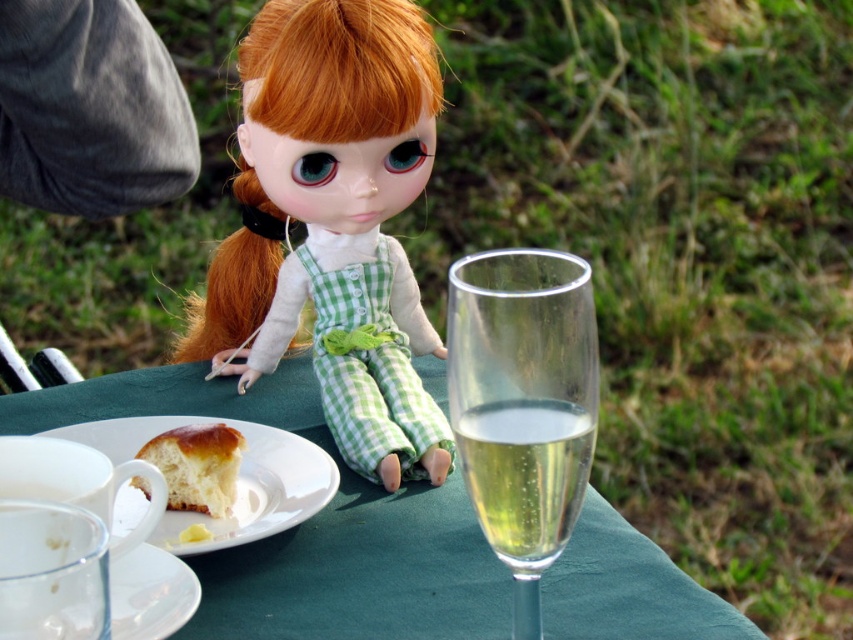
The doll is sitting at the table and wants to place a napkin between the white ceramic plate at lower left and the transparent glass saucer at lower left. Which object should the napkin be placed closer to if it needs to cover more surface area?

The napkin should be placed closer to the white ceramic plate at lower left because it is larger in size than the transparent glass saucer at lower left, allowing the napkin to cover more surface area.

You are standing at the position of the viewer and want to reach the point marked at coordinates point (271, 182). If your arm is 24 inches long, can you comfortably reach it without moving your feet?

The distance between you and the point (271, 182) is 23.37 inches, which is slightly shorter than your 24 inch arm length. Therefore, you can comfortably reach it without moving your feet.

You are a guest at a garden party and see the green checkered doll at center and the golden brown bread at center on the table. Which object is closer to the right edge of the table?

The green checkered doll at center is closer to the right edge of the table because it is positioned to the right of the golden brown bread at center.